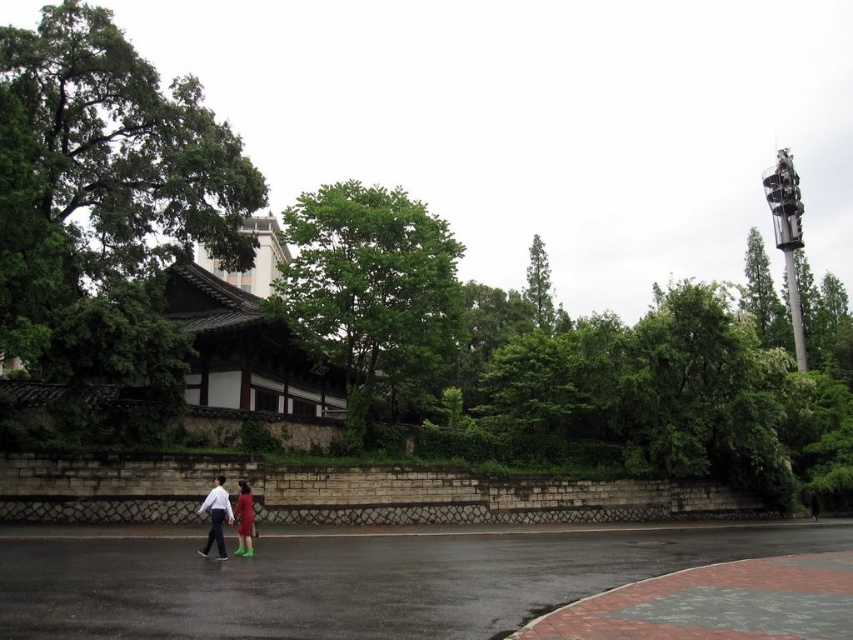
Question: Which object is farther from the camera taking this photo?

Choices:
 (A) matte green boots at lower center
 (B) green leafy tree at center
 (C) matte green dress at center

Answer: (B)

Question: Is green leafy tree at upper left thinner than matte green boots at lower center?

Choices:
 (A) yes
 (B) no

Answer: (B)

Question: Is green leafy tree at upper left thinner than matte green boots at lower center?

Choices:
 (A) no
 (B) yes

Answer: (A)

Question: Which object is farther from the camera taking this photo?

Choices:
 (A) green leafy tree at upper left
 (B) matte green boots at lower center
 (C) matte green dress at center
 (D) green leafy tree at center

Answer: (D)

Question: Can you confirm if green leafy tree at upper left is wider than matte green boots at lower center?

Choices:
 (A) no
 (B) yes

Answer: (B)

Question: Which point appears farthest from the camera in this image?

Choices:
 (A) (242, 504)
 (B) (548, 310)
 (C) (357, 243)

Answer: (B)